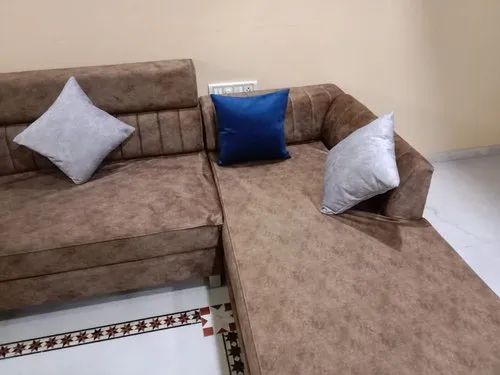
Where is `gray pillows`? The height and width of the screenshot is (375, 500). gray pillows is located at coordinates [88, 132], [365, 166].